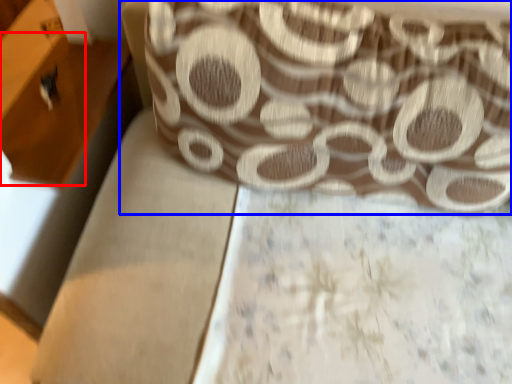
Question: Among these objects, which one is nearest to the camera, drawer (highlighted by a red box) or curtain (highlighted by a blue box)?

Choices:
 (A) drawer
 (B) curtain

Answer: (B)